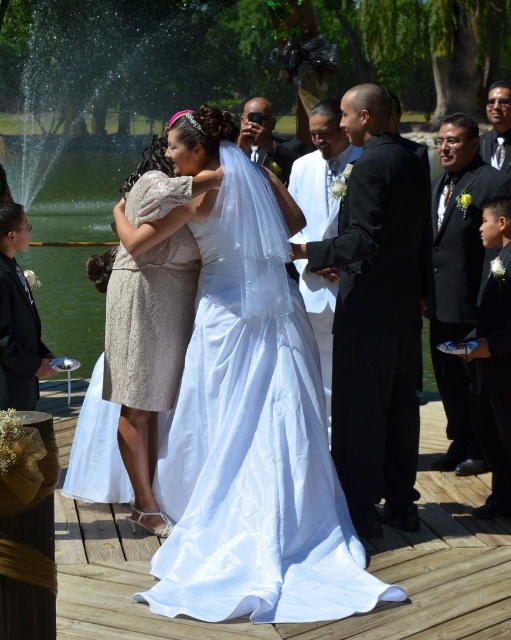
Is point (462, 368) behind point (296, 262)?

No, (462, 368) is closer to viewer.

Is black satin suit at right above shiny black suit at center?

Actually, black satin suit at right is below shiny black suit at center.

Between point (497, 170) and point (314, 330), which one is positioned behind?

Point (314, 330)

I want to click on black satin suit at right, so click(457, 276).

Which is more to the right, shiny black suit at center or matte black camera at center?

shiny black suit at center is more to the right.

Can you confirm if shiny black suit at center is smaller than matte black camera at center?

Incorrect, shiny black suit at center is not smaller in size than matte black camera at center.

I want to click on shiny black suit at center, so click(320, 172).

Can you confirm if black satin suit at center is bigger than matte black camera at center?

Correct, black satin suit at center is larger in size than matte black camera at center.

Which is behind, point (367, 340) or point (262, 113)?

The point (262, 113) is behind.

You are a GUI agent. You are given a task and a screenshot of the screen. Output one action in this format:
    pyautogui.click(x=<x>, y=<y>)
    Task: Click on the black satin suit at center
    This screenshot has height=640, width=511.
    Given the screenshot: What is the action you would take?
    pyautogui.click(x=377, y=316)